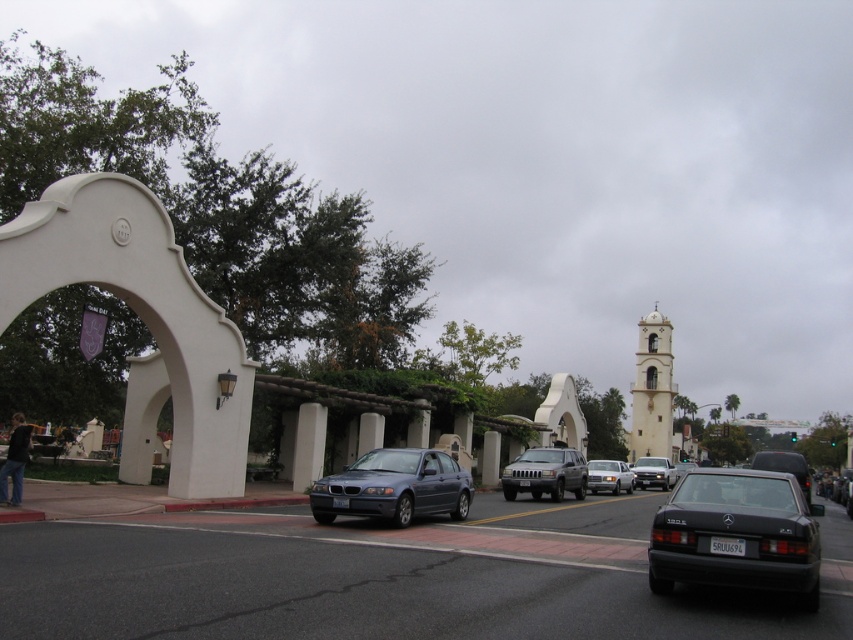
Consider the image. Who is more distant from viewer, [379,493] or [593,481]?

The point [593,481] is behind.

Can you confirm if satin blue sedan at center is shorter than silver metallic sedan at center?

Yes.

At what (x,y) coordinates should I click in order to perform the action: click on satin blue sedan at center. Please return your answer as a coordinate pair (x, y). Looking at the image, I should click on (393, 486).

Identify the location of satin blue sedan at center. This screenshot has height=640, width=853. (393, 486).

Is point (506, 499) more distant than point (611, 468)?

No.

Between matte silver suv at center and silver metallic sedan at center, which one is positioned lower?

Positioned lower is silver metallic sedan at center.

Does point (531, 492) come farther from viewer compared to point (628, 480)?

No, (531, 492) is closer to viewer.

You are a GUI agent. You are given a task and a screenshot of the screen. Output one action in this format:
    pyautogui.click(x=<x>, y=<y>)
    Task: Click on the matte silver suv at center
    The height and width of the screenshot is (640, 853).
    Given the screenshot: What is the action you would take?
    544,474

Is point (682, 568) farther from camera compared to point (683, 474)?

That is False.

The height and width of the screenshot is (640, 853). What do you see at coordinates (737, 534) in the screenshot?
I see `black matte sedan at lower right` at bounding box center [737, 534].

Is point (810, 531) farther from viewer compared to point (682, 472)?

No.

Identify the location of black matte sedan at lower right. (737, 534).